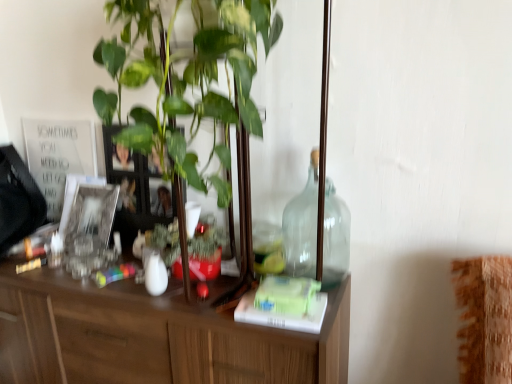
Question: Is green matte book at center to the left of silver metallic picture frame at left from the viewer's perspective?

Choices:
 (A) no
 (B) yes

Answer: (A)

Question: From a real-world perspective, does green matte book at center sit lower than silver metallic picture frame at left?

Choices:
 (A) yes
 (B) no

Answer: (A)

Question: From the image's perspective, is green matte book at center above silver metallic picture frame at left?

Choices:
 (A) no
 (B) yes

Answer: (A)

Question: Considering the relative sizes of green matte book at center and silver metallic picture frame at left in the image provided, is green matte book at center smaller than silver metallic picture frame at left?

Choices:
 (A) no
 (B) yes

Answer: (B)

Question: Can you confirm if green matte book at center is taller than silver metallic picture frame at left?

Choices:
 (A) no
 (B) yes

Answer: (A)

Question: From the image's perspective, is green matte book at center above or below silver metallic picture frame at left?

Choices:
 (A) above
 (B) below

Answer: (B)

Question: Is green matte book at center bigger or smaller than silver metallic picture frame at left?

Choices:
 (A) big
 (B) small

Answer: (B)

Question: Is point (309, 321) closer or farther from the camera than point (113, 254)?

Choices:
 (A) farther
 (B) closer

Answer: (B)

Question: Is green matte book at center in front of or behind silver metallic picture frame at left in the image?

Choices:
 (A) front
 (B) behind

Answer: (A)

Question: Considering the positions of point (331, 196) and point (288, 314), is point (331, 196) closer or farther from the camera than point (288, 314)?

Choices:
 (A) closer
 (B) farther

Answer: (B)

Question: Is transparent glass bottle at center-right inside or outside of green matte book at center?

Choices:
 (A) outside
 (B) inside

Answer: (A)

Question: Relative to green matte book at center, is transparent glass bottle at center-right in front or behind?

Choices:
 (A) front
 (B) behind

Answer: (B)

Question: Visually, is transparent glass bottle at center-right positioned to the left or to the right of green matte book at center?

Choices:
 (A) left
 (B) right

Answer: (B)

Question: Considering the relative positions of silver metallic picture frame at left and green matte book at center in the image provided, is silver metallic picture frame at left to the left or to the right of green matte book at center?

Choices:
 (A) right
 (B) left

Answer: (B)

Question: From their relative heights in the image, would you say silver metallic picture frame at left is taller or shorter than green matte book at center?

Choices:
 (A) tall
 (B) short

Answer: (A)